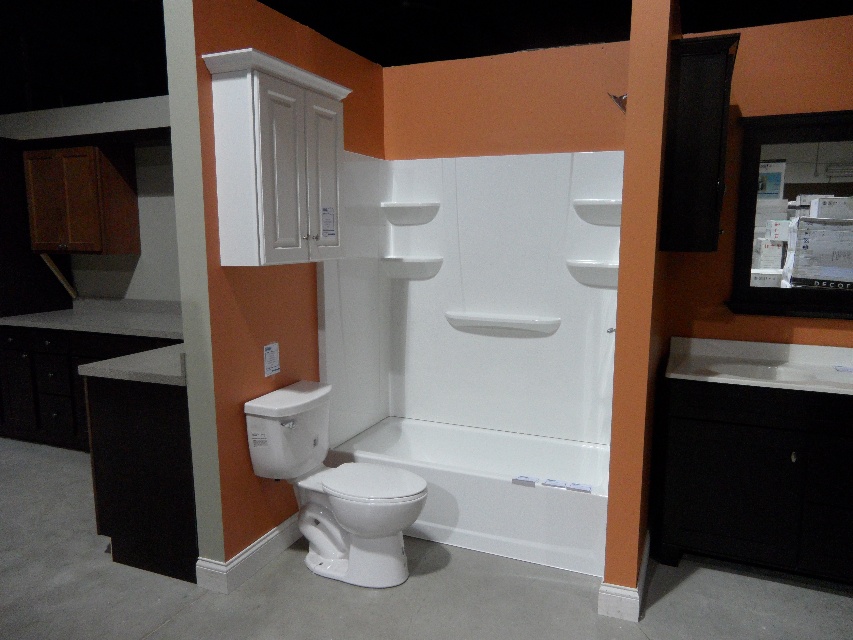
You are standing in the bathroom and want to locate the matte black medicine cabinet at upper right. Based on the 2D coordinates provided, which corner of the bathroom wall is it closest to?

The matte black medicine cabinet at upper right is closest to the upper right corner of the bathroom wall since its 2D coordinates are at point 0.339 on the x and 0.932 on the y, which places it near the upper right quadrant.

You are standing in the bathroom display and want to take a photo of the point at coordinates point (811, 128). Your camera has a minimum focus distance of 10 feet. Will the camera be able to focus on the point?

The point (811, 128) is 10.16 feet away from the camera, which is slightly beyond the minimum focus distance of 10 feet. Therefore, the camera may not be able to focus on the point unless adjusted.

You are designing a bathroom layout and need to place a new cabinet between the white glossy toilet at lower center and the white glossy toilet at center. Which toilet should the cabinet be placed closer to if the cabinet requires more space on the side where the toilet is wider?

The cabinet should be placed closer to the white glossy toilet at lower center because it is wider than the white glossy toilet at center, providing the necessary space for the cabinet.